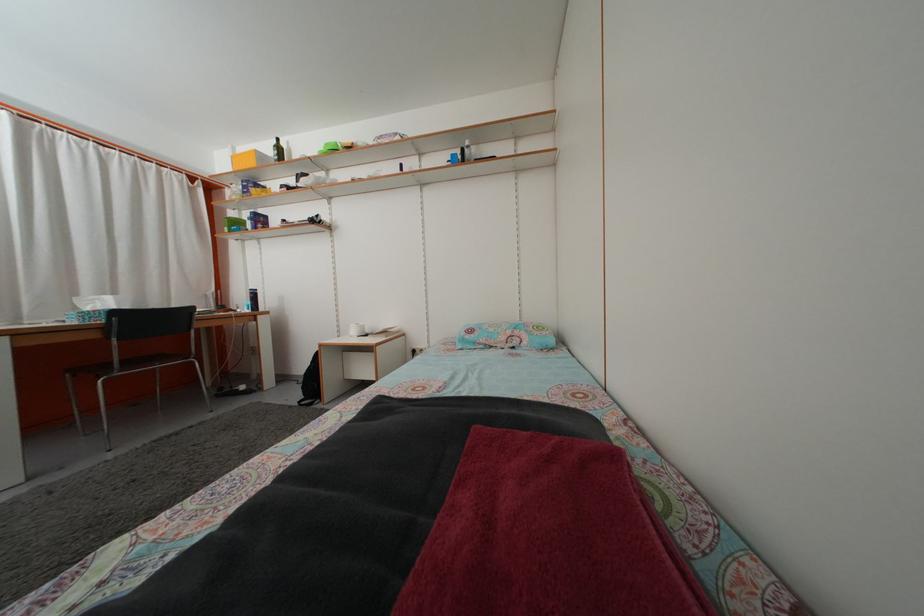
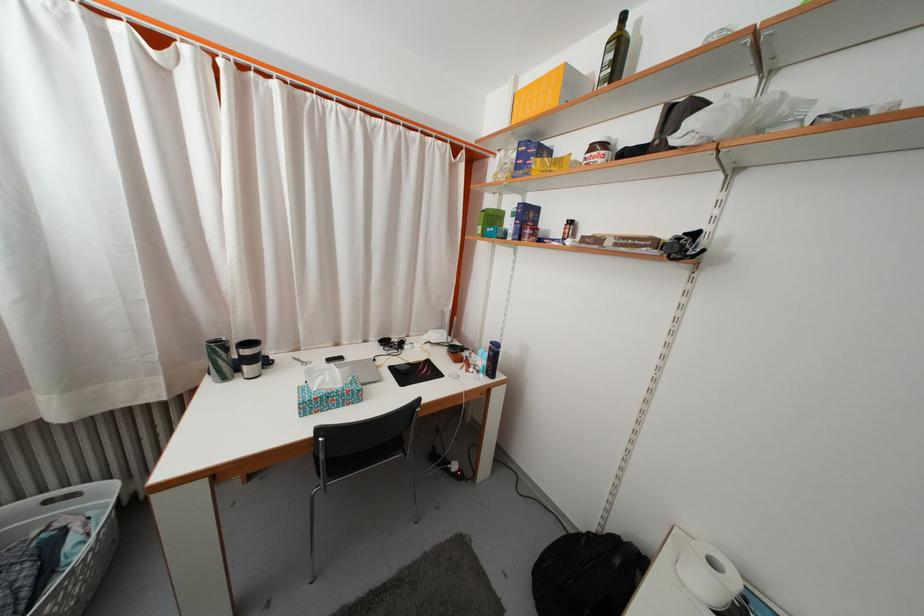
Where in the second image is the point corresponding to the point at 242,231 from the first image?

(500, 225)